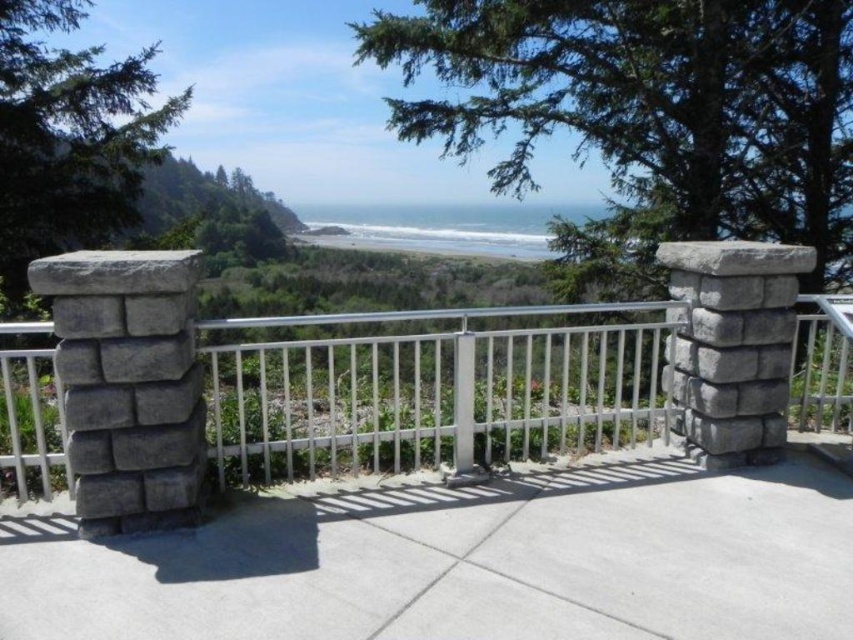
Who is shorter, white metal fence at center or blue water at center?

white metal fence at center is shorter.

Can you confirm if white metal fence at center is shorter than blue water at center?

Yes, white metal fence at center is shorter than blue water at center.

Is point (259, 468) positioned after point (386, 224)?

No, it is not.

Identify the location of white metal fence at center. The width and height of the screenshot is (853, 640). click(x=430, y=387).

Between gray concrete deck at center and blue water at center, which one appears on the right side from the viewer's perspective?

gray concrete deck at center is more to the right.

Does gray concrete deck at center have a greater width compared to blue water at center?

In fact, gray concrete deck at center might be narrower than blue water at center.

Who is more forward, (73, 534) or (457, 236)?

Positioned in front is point (73, 534).

Where is `gray concrete deck at center`? Image resolution: width=853 pixels, height=640 pixels. gray concrete deck at center is located at coordinates (465, 561).

Is gray concrete deck at center thinner than white metal fence at center?

Yes.

Between gray concrete deck at center and white metal fence at center, which one has less height?

gray concrete deck at center is shorter.

The image size is (853, 640). What do you see at coordinates (465, 561) in the screenshot?
I see `gray concrete deck at center` at bounding box center [465, 561].

This screenshot has height=640, width=853. Identify the location of gray concrete deck at center. (465, 561).